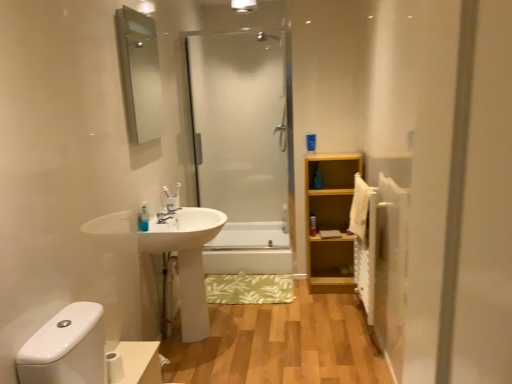
In order to click on vacant space in front of light wood shelf at right in this screenshot , I will do `click(332, 302)`.